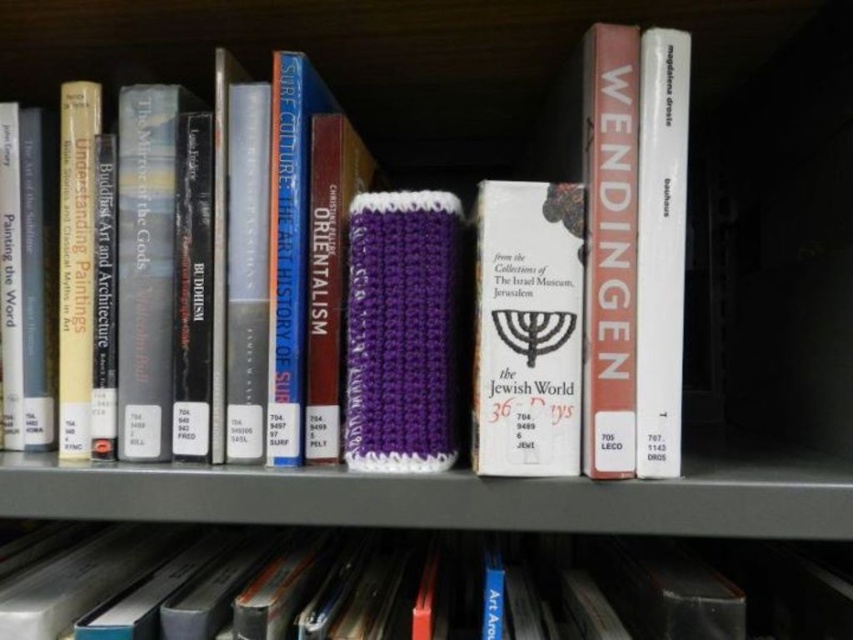
You are organizing a library and see the white paper book at center and the purple knitted sleeve at center on the shelf. Which item is placed on top of the other?

The white paper book at center is positioned over purple knitted sleeve at center, so the white paper book at center is on top of the purple knitted sleeve at center.